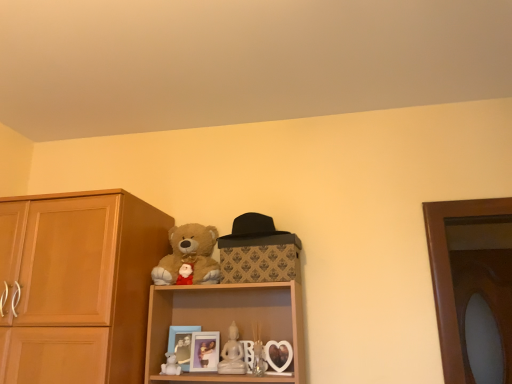
Question: Is transparent glass door at right oriented away from matte blue picture frame at lower center, which appears as the 2th picture frame when viewed from the right?

Choices:
 (A) yes
 (B) no

Answer: (B)

Question: Is transparent glass door at right completely or partially outside of matte blue picture frame at lower center, which appears as the 2th picture frame when viewed from the right?

Choices:
 (A) no
 (B) yes

Answer: (B)

Question: Is transparent glass door at right further to the viewer compared to matte blue picture frame at lower center, which appears as the 2th picture frame when viewed from the right?

Choices:
 (A) no
 (B) yes

Answer: (B)

Question: Is transparent glass door at right thinner than matte blue picture frame at lower center, which appears as the 2th picture frame when viewed from the right?

Choices:
 (A) no
 (B) yes

Answer: (A)

Question: From the image's perspective, is transparent glass door at right above matte blue picture frame at lower center, the first picture frame in the left-to-right sequence?

Choices:
 (A) no
 (B) yes

Answer: (A)

Question: Is light brown wood cabinet at left bigger or smaller than white porcelain figurine at center?

Choices:
 (A) big
 (B) small

Answer: (A)

Question: Looking at their shapes, would you say light brown wood cabinet at left is wider or thinner than white porcelain figurine at center?

Choices:
 (A) wide
 (B) thin

Answer: (A)

Question: Would you say light brown wood cabinet at left is inside or outside white porcelain figurine at center?

Choices:
 (A) outside
 (B) inside

Answer: (A)

Question: Does point (39, 322) appear closer or farther from the camera than point (234, 342)?

Choices:
 (A) farther
 (B) closer

Answer: (B)

Question: Relative to white matte teddy bear at lower center, is light brown wood cabinet at left in front or behind?

Choices:
 (A) front
 (B) behind

Answer: (A)

Question: Considering the positions of light brown wood cabinet at left and white matte teddy bear at lower center in the image, is light brown wood cabinet at left wider or thinner than white matte teddy bear at lower center?

Choices:
 (A) wide
 (B) thin

Answer: (A)

Question: Is light brown wood cabinet at left inside or outside of white matte teddy bear at lower center?

Choices:
 (A) outside
 (B) inside

Answer: (A)

Question: From a real-world perspective, relative to white matte teddy bear at lower center, is light brown wood cabinet at left vertically above or below?

Choices:
 (A) below
 (B) above

Answer: (B)

Question: Relative to soft plush teddy bear at upper center, is matte plastic picture frame at center, the 2th picture frame from the left, in front or behind?

Choices:
 (A) behind
 (B) front

Answer: (A)

Question: Considering the positions of matte plastic picture frame at center, the 2th picture frame from the left, and soft plush teddy bear at upper center in the image, is matte plastic picture frame at center, the 2th picture frame from the left, wider or thinner than soft plush teddy bear at upper center?

Choices:
 (A) wide
 (B) thin

Answer: (B)